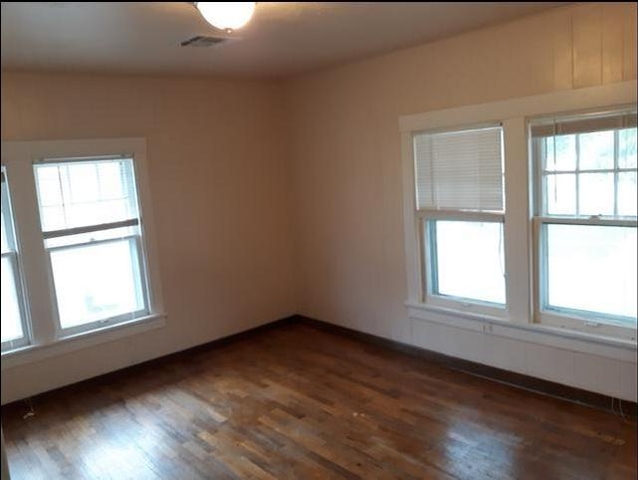
I want to click on corner of the room, so click(293, 201).